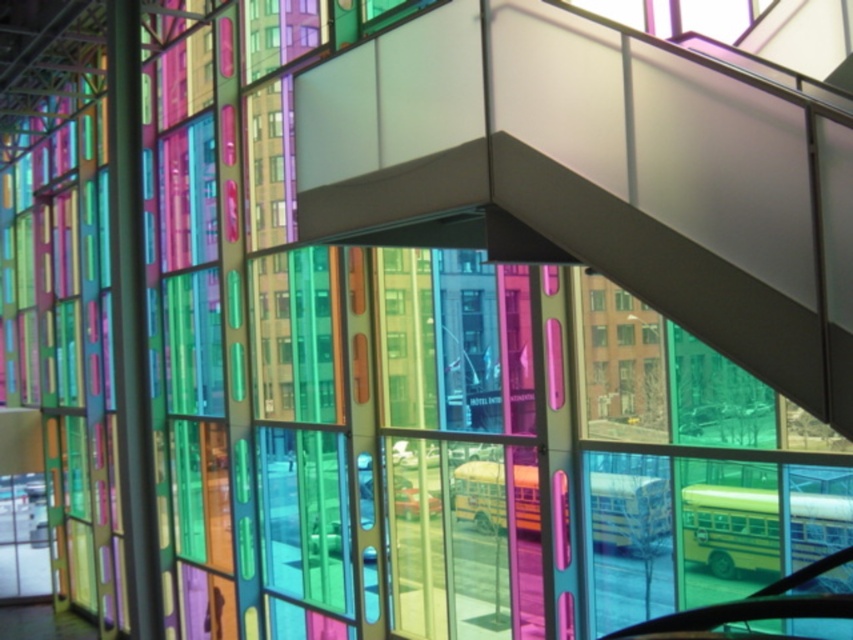
Question: Is yellow matte school bus at lower right positioned at the back of yellow matte school bus at center?

Choices:
 (A) yes
 (B) no

Answer: (B)

Question: Is yellow matte school bus at lower right wider than yellow matte school bus at center?

Choices:
 (A) no
 (B) yes

Answer: (B)

Question: Is yellow matte school bus at lower right to the left of yellow matte school bus at center from the viewer's perspective?

Choices:
 (A) yes
 (B) no

Answer: (B)

Question: Which object appears farthest from the camera in this image?

Choices:
 (A) yellow matte school bus at center
 (B) yellow matte school bus at lower right

Answer: (A)